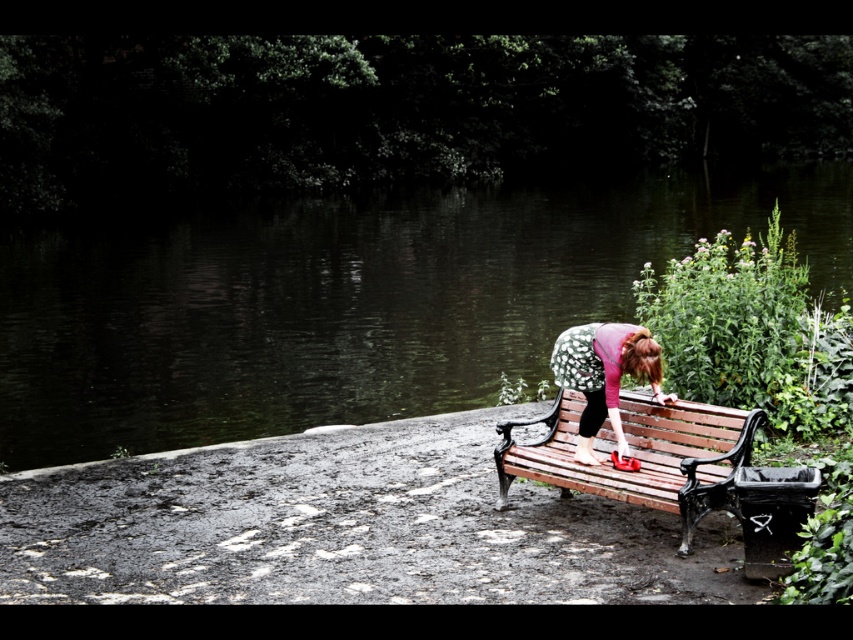
Based on the photo, you are a photographer planning to take a wide shot of the scene. You want to ensure both the dark green water at center and the floral fabric dress at center are fully visible in the frame. Based on their relative sizes, which object might require you to adjust your camera angle to include it properly?

The dark green water at center is wider than the floral fabric dress at center, so you may need to adjust your camera angle to ensure the wider dark green water at center fits entirely within the frame.

You are standing at the wooden bench with ornate metal armrests and legs in the scene. There are two points marked on the ground around the bench. One is at coordinate point (534, 445) and the other at point (566, 364). Which point is closer to your current position?

Point (534, 445) is further to the camera than point (566, 364), so the point closer to your current position at the bench would be point (566, 364).